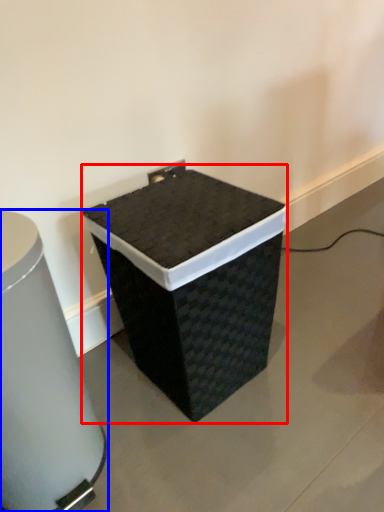
Question: Which object appears farthest to the camera in this image, waste container (highlighted by a red box) or waste container (highlighted by a blue box)?

Choices:
 (A) waste container
 (B) waste container

Answer: (A)